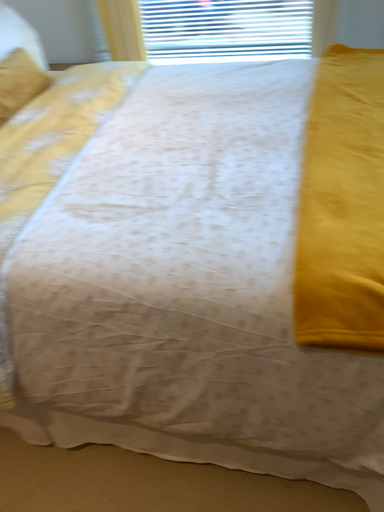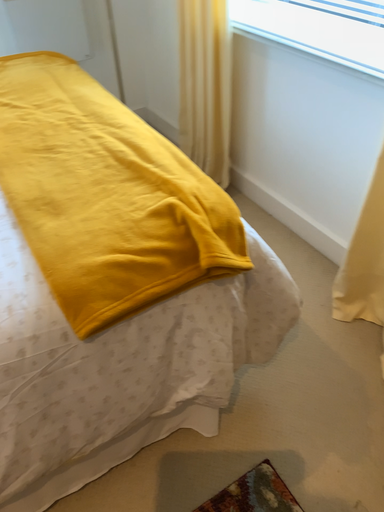
Question: How did the camera likely rotate when shooting the video?

Choices:
 (A) rotated upward
 (B) rotated downward

Answer: (A)